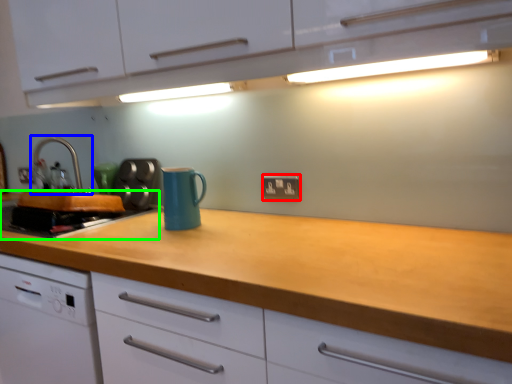
Question: Which is nearer to the electric outlet (highlighted by a red box)? tap (highlighted by a blue box) or kitchen appliance (highlighted by a green box).

Choices:
 (A) tap
 (B) kitchen appliance

Answer: (B)